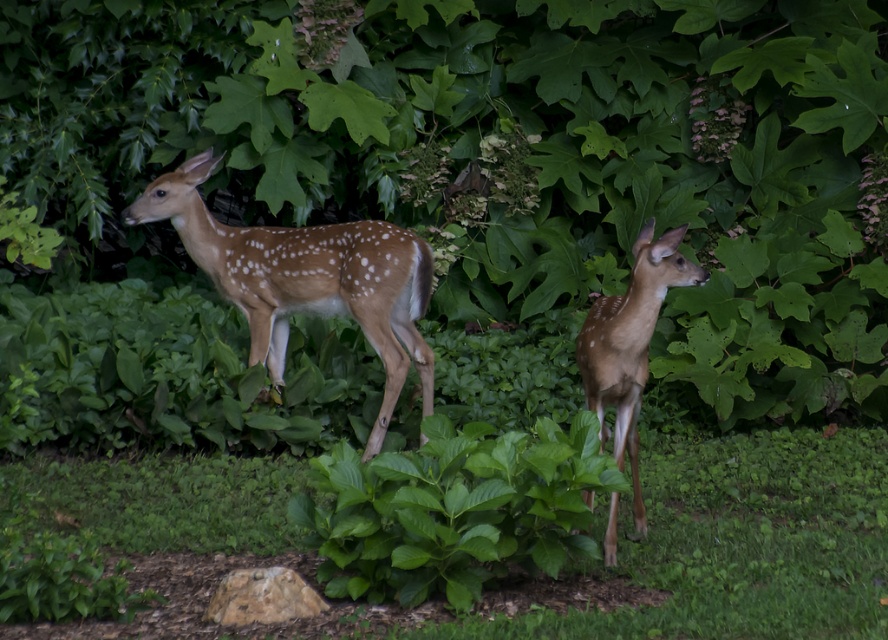
You are a photographer trying to capture both deer in a single shot. You notice two points marked in the image at coordinates point (x=768, y=93) and point (x=674, y=544). Which point should you focus on to ensure both deer are in focus?

Point (x=674, y=544) should be focused on because it is in front of point (x=768, y=93). Focusing on the closer point will help keep both deer in focus as the depth of field extends backward.

You are a photographer trying to capture a photo of the two deer in the scene. You need to adjust your camera focus so that both deer are in sharp focus. Given that the two points in the scene, point (x=263, y=6) and point (x=591, y=372), are at different distances from the camera, which point should you focus on to ensure both deer are in focus?

You should focus on point (x=263, y=6) because it is closer to the camera than point (x=591, y=372). By focusing on the closer point, the depth of field will extend further back, potentially covering both the near and far deer.